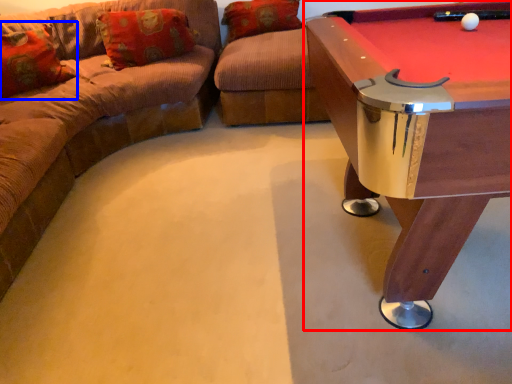
Question: Among these objects, which one is nearest to the camera, table (highlighted by a red box) or pillow (highlighted by a blue box)?

Choices:
 (A) table
 (B) pillow

Answer: (A)